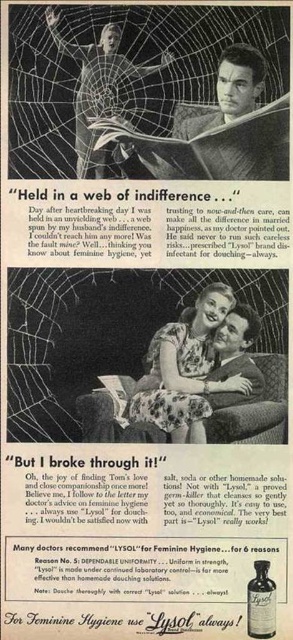
Question: Can you confirm if smooth skin man at upper right is positioned to the right of floral dress at center?

Choices:
 (A) no
 (B) yes

Answer: (B)

Question: Which point appears farthest from the camera in this image?

Choices:
 (A) (263, 625)
 (B) (92, 77)
 (C) (242, 378)
 (D) (210, 113)

Answer: (C)

Question: Which object appears farthest from the camera in this image?

Choices:
 (A) matte black dress at upper center
 (B) floral dress at center
 (C) smooth skin man at upper right

Answer: (B)

Question: Which point is farther to the camera?

Choices:
 (A) translucent glass bottle at center
 (B) smooth skin man at upper right
 (C) matte black dress at upper center

Answer: (B)

Question: Can you confirm if matte black dress at upper center is thinner than translucent glass bottle at center?

Choices:
 (A) no
 (B) yes

Answer: (A)

Question: Can you confirm if smooth skin man at upper right is positioned to the left of matte black dress at upper center?

Choices:
 (A) yes
 (B) no

Answer: (B)